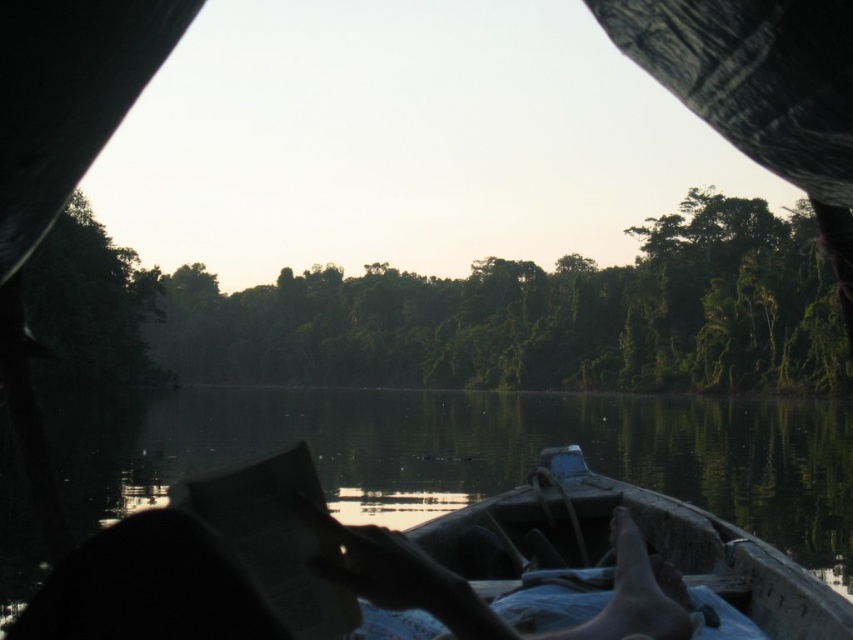
In the scene shown: You are sitting in a boat and want to observe the water beneath you. Which object, the transparent water at center or the wooden canoe at center, is closer to your eyes?

The transparent water at center is closer to your eyes because the wooden canoe at center is behind it.

You are standing on the deck of a cruise ship and see a small wooden boat in the distance. You notice the transparent water at center and the dark skin at lower center. How far apart are these two objects in the boat?

The transparent water at center and dark skin at lower center are 180.39 feet apart from each other.